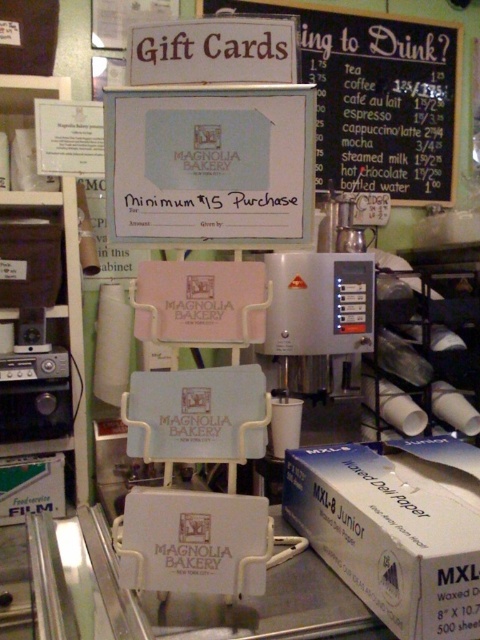
Can you confirm if waxed paper at lower right is thinner than black chalkboard at upper center?

Yes.

Does waxed paper at lower right have a greater width compared to black chalkboard at upper center?

In fact, waxed paper at lower right might be narrower than black chalkboard at upper center.

Where is `waxed paper at lower right`? The width and height of the screenshot is (480, 640). waxed paper at lower right is located at coordinates (396, 529).

Identify the location of waxed paper at lower right. pos(396,529).

Can you confirm if waxed paper at lower right is smaller than satin silver machine at center?

Correct, waxed paper at lower right occupies less space than satin silver machine at center.

Between waxed paper at lower right and satin silver machine at center, which one has more height?

With more height is satin silver machine at center.

Find the location of a particular element. The height and width of the screenshot is (640, 480). waxed paper at lower right is located at coordinates coord(396,529).

Is black chalkboard at upper center closer to the viewer compared to satin silver machine at center?

That is False.

Who is more forward, (344, 115) or (319, 381)?

Positioned in front is point (319, 381).

Is point (429, 170) less distant than point (335, 365)?

No, it is behind (335, 365).

Where is `black chalkboard at upper center`? The width and height of the screenshot is (480, 640). black chalkboard at upper center is located at coordinates (376, 99).